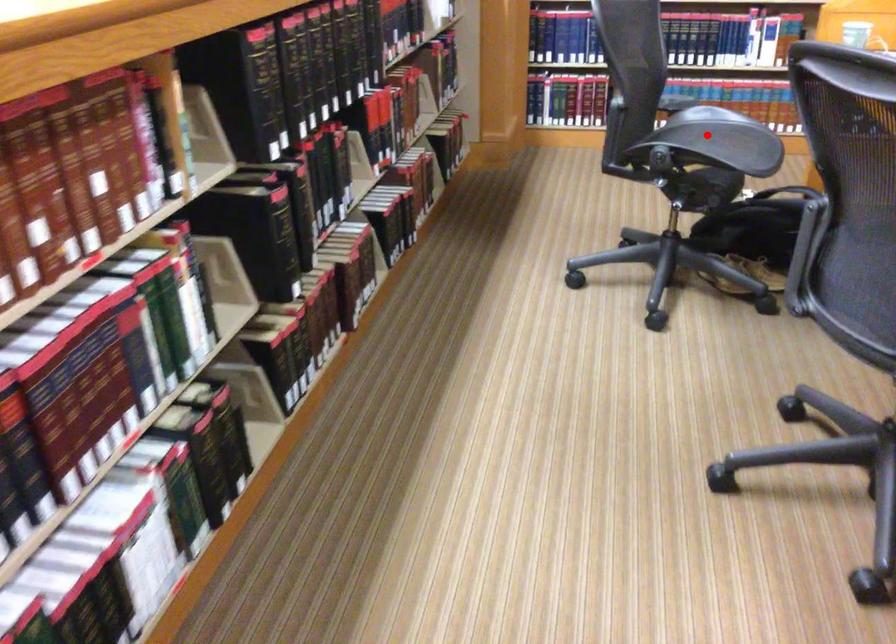
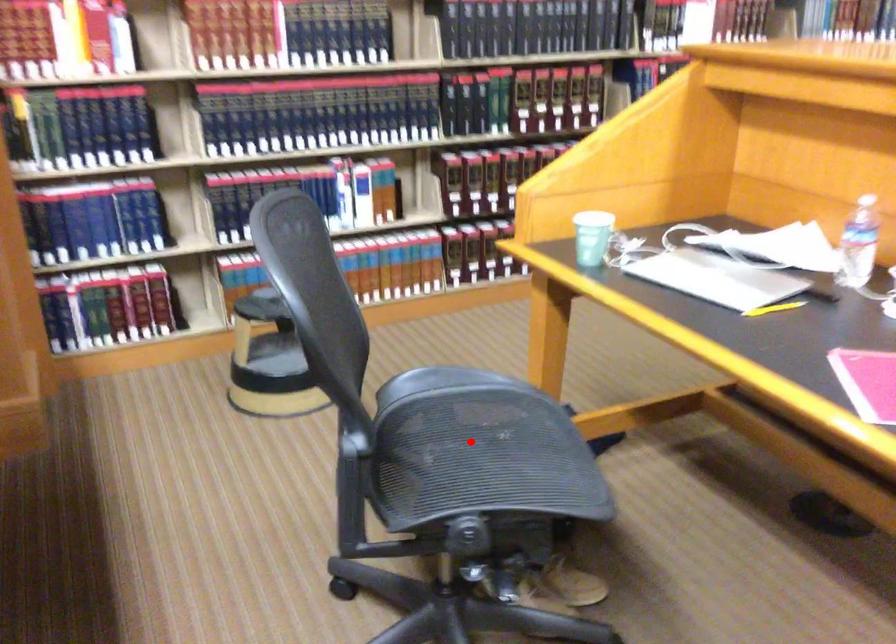
I am providing you with two images of the same scene from different viewpoints. A red point is marked on the first image and another point is marked on the second image. Do the highlighted points in image1 and image2 indicate the same real-world spot?

Yes